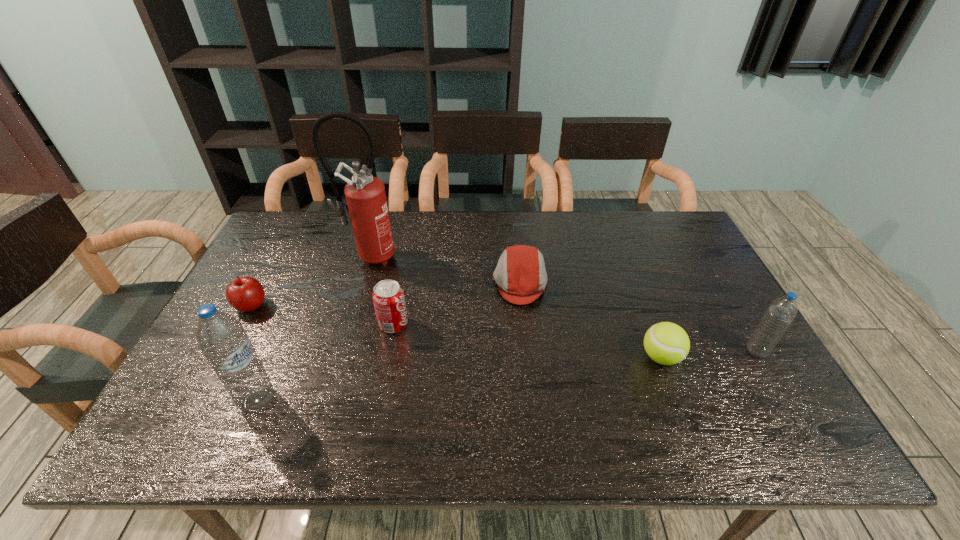
Find the location of a particular element. The height and width of the screenshot is (540, 960). location for an additional water_bottle to make spacing equal is located at coordinates (519, 375).